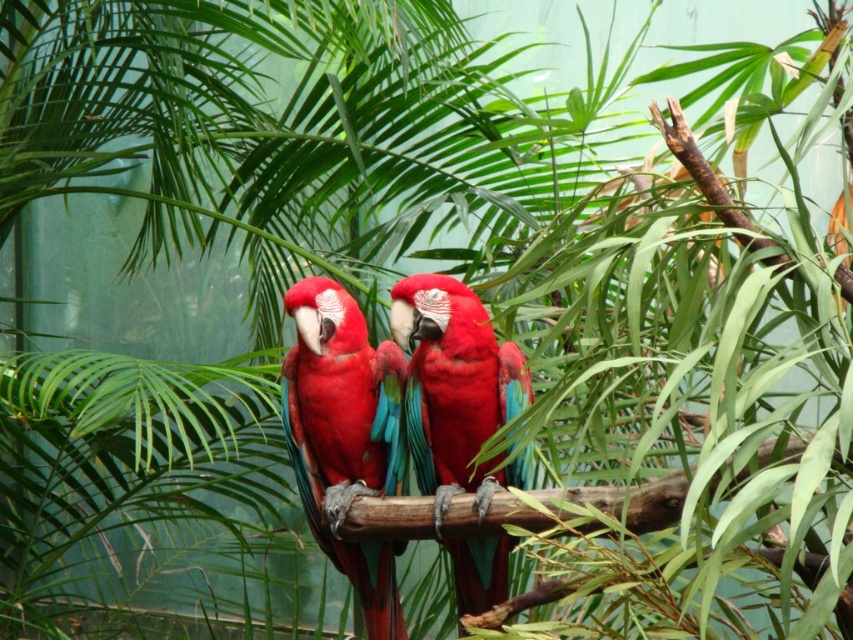
You are a zookeeper observing two parrots in their enclosure. You notice a matte red parrot at center and a glossy red parrot at center. Which parrot is sitting higher up on the branch?

The matte red parrot at center is positioned over the glossy red parrot at center, so it is sitting higher up on the branch.

You are a zookeeper observing two parrots in their enclosure. You notice a matte red parrot at center and a glossy red parrot at center. Which parrot would require a smaller feeding dish based on their size?

The matte red parrot at center is smaller than the glossy red parrot at center, so it would require a smaller feeding dish.